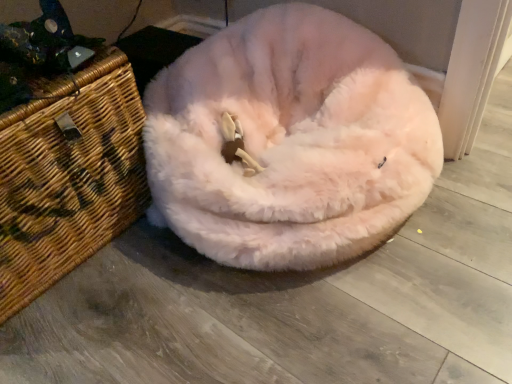
You are a GUI agent. You are given a task and a screenshot of the screen. Output one action in this format:
    pyautogui.click(x=<x>, y=<y>)
    Task: Click on the fuzzy white dog bed at center
    This screenshot has width=512, height=384.
    Given the screenshot: What is the action you would take?
    pyautogui.click(x=289, y=141)

What do you see at coordinates (289, 141) in the screenshot? I see `fuzzy white dog bed at center` at bounding box center [289, 141].

The height and width of the screenshot is (384, 512). What do you see at coordinates (68, 177) in the screenshot?
I see `woven brown basket at left` at bounding box center [68, 177].

Where is `woven brown basket at left`? woven brown basket at left is located at coordinates (68, 177).

The height and width of the screenshot is (384, 512). What are the coordinates of `fuzzy white dog bed at center` in the screenshot? It's located at (289, 141).

Considering the relative positions of fuzzy white dog bed at center and woven brown basket at left in the image provided, is fuzzy white dog bed at center to the left of woven brown basket at left from the viewer's perspective?

Incorrect, fuzzy white dog bed at center is not on the left side of woven brown basket at left.

Is fuzzy white dog bed at center closer to the viewer compared to woven brown basket at left?

Yes, it is in front of woven brown basket at left.

Does point (327, 264) lie in front of point (121, 156)?

That is True.

From the image's perspective, is fuzzy white dog bed at center on top of woven brown basket at left?

Yes, from the image's perspective, fuzzy white dog bed at center is over woven brown basket at left.

From a real-world perspective, which is physically below, fuzzy white dog bed at center or woven brown basket at left?

From a 3D spatial view, fuzzy white dog bed at center is below.

Considering the sizes of fuzzy white dog bed at center and woven brown basket at left in the image, is fuzzy white dog bed at center wider or thinner than woven brown basket at left?

fuzzy white dog bed at center is wider than woven brown basket at left.

Who is taller, fuzzy white dog bed at center or woven brown basket at left?

With more height is woven brown basket at left.

Based on the photo, is fuzzy white dog bed at center bigger than woven brown basket at left?

Yes, fuzzy white dog bed at center is bigger than woven brown basket at left.

Is woven brown basket at left located within fuzzy white dog bed at center?

No, woven brown basket at left is not a part of fuzzy white dog bed at center.

Is fuzzy white dog bed at center far from woven brown basket at left?

fuzzy white dog bed at center is near woven brown basket at left, not far away.

Is fuzzy white dog bed at center oriented away from woven brown basket at left?

fuzzy white dog bed at center does not have its back to woven brown basket at left.

How different are the orientations of fuzzy white dog bed at center and woven brown basket at left in degrees?

They differ by 90 degrees in their facing directions.

Measure the distance between fuzzy white dog bed at center and woven brown basket at left.

10.56 inches.

At what (x,y) coordinates should I click in order to perform the action: click on basket behind the fuzzy white dog bed at center. Please return your answer as a coordinate pair (x, y). Looking at the image, I should click on (68, 177).

Based on the photo, which object is positioned more to the right, woven brown basket at left or fuzzy white dog bed at center?

fuzzy white dog bed at center.

Considering the positions of objects woven brown basket at left and fuzzy white dog bed at center in the image provided, who is in front, woven brown basket at left or fuzzy white dog bed at center?

fuzzy white dog bed at center.

Considering the points (136, 126) and (321, 49), which point is behind, point (136, 126) or point (321, 49)?

The point (321, 49) is farther from the camera.

From the image's perspective, does woven brown basket at left appear higher than fuzzy white dog bed at center?

No, from the image's perspective, woven brown basket at left is not on top of fuzzy white dog bed at center.

From a real-world perspective, is woven brown basket at left positioned over fuzzy white dog bed at center based on gravity?

Yes, from a real-world perspective, woven brown basket at left is over fuzzy white dog bed at center

Can you confirm if woven brown basket at left is thinner than fuzzy white dog bed at center?

Yes, woven brown basket at left is thinner than fuzzy white dog bed at center.

In terms of height, does woven brown basket at left look taller or shorter compared to fuzzy white dog bed at center?

woven brown basket at left is taller than fuzzy white dog bed at center.

Between woven brown basket at left and fuzzy white dog bed at center, which one has smaller size?

woven brown basket at left is smaller.

Is woven brown basket at left not within fuzzy white dog bed at center?

Yes, woven brown basket at left is not within fuzzy white dog bed at center.

Are woven brown basket at left and fuzzy white dog bed at center making contact?

woven brown basket at left is not next to fuzzy white dog bed at center, and they're not touching.

Is fuzzy white dog bed at center at the back of woven brown basket at left?

woven brown basket at left does not have its back to fuzzy white dog bed at center.

The height and width of the screenshot is (384, 512). What are the coordinates of `basket behind the fuzzy white dog bed at center` in the screenshot? It's located at pyautogui.click(x=68, y=177).

At what (x,y) coordinates should I click in order to perform the action: click on dog bed located above the woven brown basket at left (from the image's perspective). Please return your answer as a coordinate pair (x, y). This screenshot has height=384, width=512. Looking at the image, I should click on (289, 141).

At what (x,y) coordinates should I click in order to perform the action: click on basket located above the fuzzy white dog bed at center (from a real-world perspective). Please return your answer as a coordinate pair (x, y). This screenshot has height=384, width=512. Looking at the image, I should click on (68, 177).